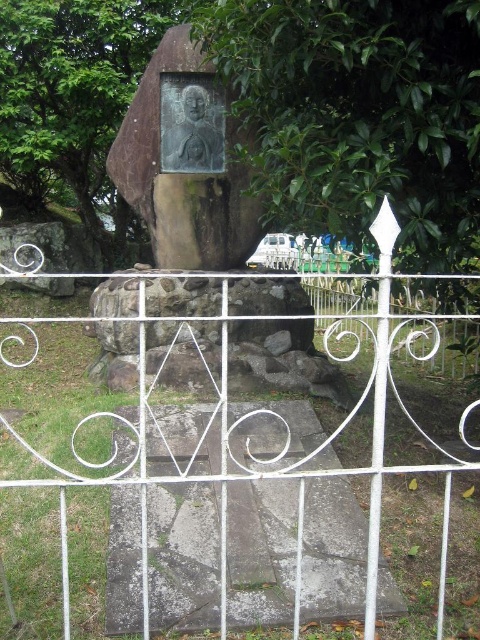
You are a visitor approaching the memorial and want to take a photo of the bronze plaque on the pedestal. The green leafy tree at upper center and the white wrought iron gate at center are in your way. Which object should you move aside to get an unobstructed view of the plaque?

The green leafy tree at upper center is much taller than the white wrought iron gate at center, so you should move the green leafy tree at upper center aside to get an unobstructed view of the plaque.